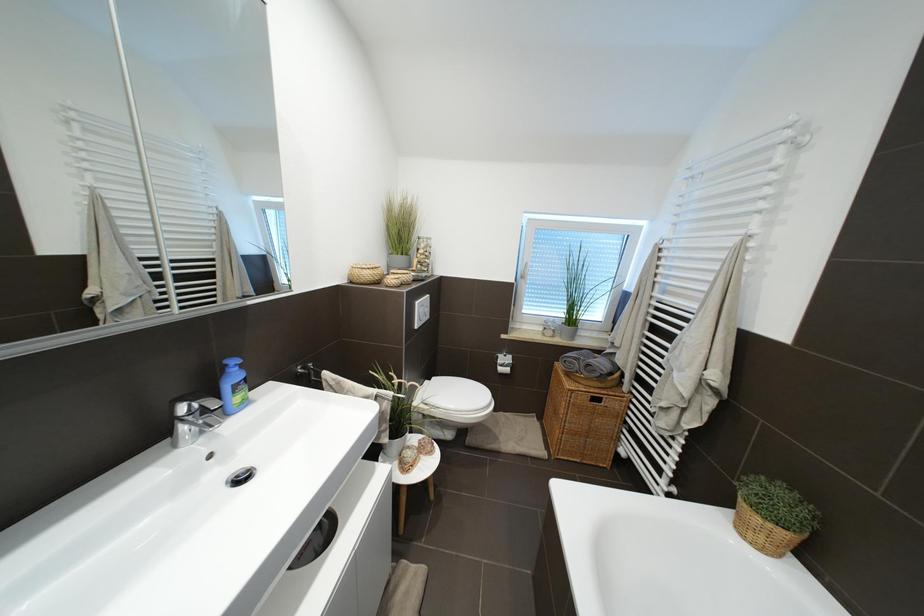
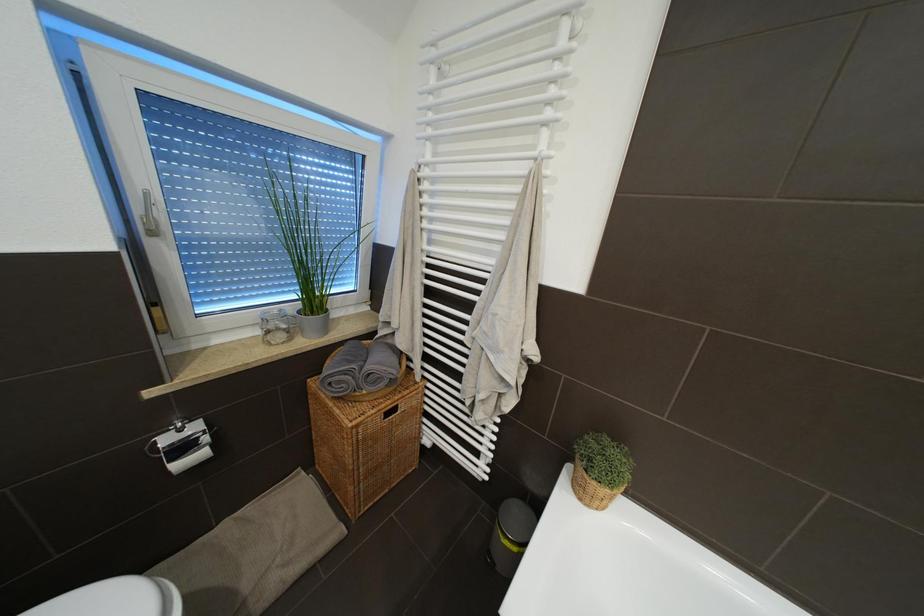
The images are taken continuously from a first-person perspective. In which direction is your viewpoint rotating?

The camera rotated toward right-down.